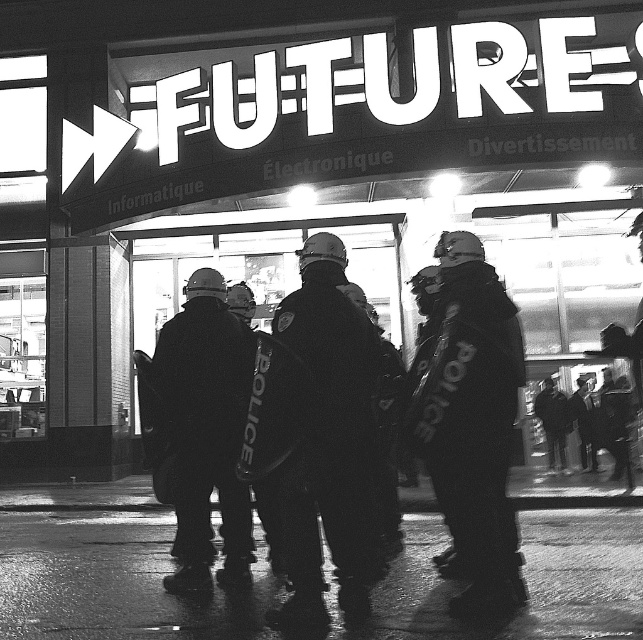
You are a photographer trying to capture the store sign and the police formation. Given that the reflective black police uniform at center is positioned at coordinates 0.661 on the x and 0.736 on the y axis, can you determine if the uniform is closer to the top or bottom of the image?

The reflective black police uniform at center is located at point (473, 422). Since the y coordinate is 0.736, which is closer to 1.0 than to 0.0, the uniform is closer to the bottom of the image.

You are a photographer trying to capture both the reflective black police uniform at center and the dark matte police uniform at center in a single frame. Which uniform should you adjust your camera focus to first if you want to ensure the one closer to the front is in focus?

The reflective black police uniform at center is positioned on the right side of dark matte police uniform at center. Since the reflective one is on the right, it is closer to the front, so focus on it first to ensure it is in focus.